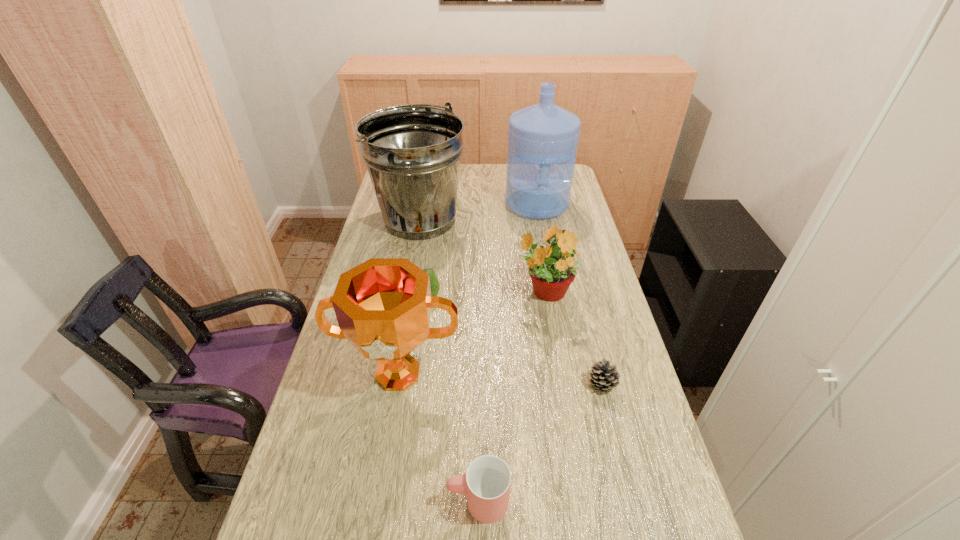
Locate an element on the screen. This screenshot has width=960, height=540. flowerpot at the right edge is located at coordinates (552, 267).

At what (x,y) coordinates should I click in order to perform the action: click on pinecone positioned at the right edge. Please return your answer as a coordinate pair (x, y). The width and height of the screenshot is (960, 540). Looking at the image, I should click on (604, 377).

Identify the location of object located at the far right corner. The height and width of the screenshot is (540, 960). (543, 138).

Find the location of a particular element. The image size is (960, 540). vacant space at the left edge is located at coordinates (401, 256).

Locate an element on the screen. This screenshot has width=960, height=540. vacant space at the right edge of the desktop is located at coordinates (639, 495).

Locate an element on the screen. The width and height of the screenshot is (960, 540). vacant space that is in between the water jug and the cup is located at coordinates (508, 353).

The height and width of the screenshot is (540, 960). I want to click on unoccupied position between the award and the pinecone, so click(x=500, y=379).

Locate an element on the screen. The image size is (960, 540). vacant space in between the pinecone and the bucket is located at coordinates (511, 302).

The height and width of the screenshot is (540, 960). I want to click on vacant area that lies between the bucket and the shortest object, so click(x=511, y=302).

This screenshot has width=960, height=540. In order to click on blank region between the water jug and the sixth shortest object in this screenshot , I will do `click(478, 212)`.